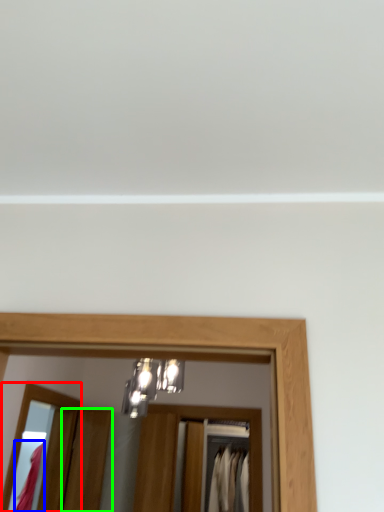
Question: Which object is the closest to the mirror (highlighted by a red box)? Choose among these: clothing (highlighted by a blue box) or door (highlighted by a green box).

Choices:
 (A) clothing
 (B) door

Answer: (B)